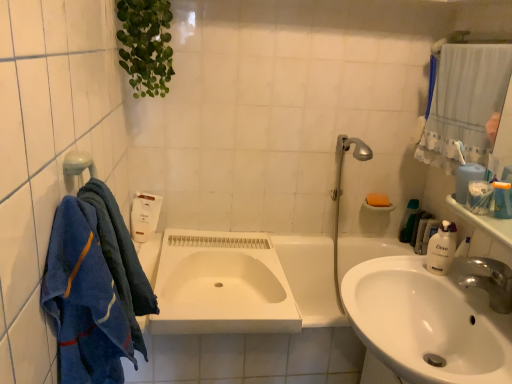
Question: Should I look upward or downward to see blue cotton towel at left, marked as the second bath towel in a back-to-front arrangement?

Choices:
 (A) down
 (B) up

Answer: (A)

Question: Is the position of white glossy sink at lower right, the first sink viewed from the right, more distant than that of white matte sink at center, the second sink from the front?

Choices:
 (A) yes
 (B) no

Answer: (B)

Question: From a real-world perspective, is white glossy sink at lower right, the 2th sink when ordered from left to right, on white matte sink at center, acting as the second sink starting from the right?

Choices:
 (A) yes
 (B) no

Answer: (A)

Question: Considering the relative sizes of white glossy sink at lower right, the first sink viewed from the right, and white matte sink at center, the second sink from the front, in the image provided, is white glossy sink at lower right, the first sink viewed from the right, thinner than white matte sink at center, the second sink from the front,?

Choices:
 (A) no
 (B) yes

Answer: (B)

Question: Is white glossy sink at lower right, the first sink when ordered from front to back, next to white matte sink at center, acting as the second sink starting from the right, and touching it?

Choices:
 (A) no
 (B) yes

Answer: (A)

Question: Is white glossy sink at lower right, the first sink when ordered from front to back, far from white matte sink at center, which is counted as the 1th sink, starting from the back?

Choices:
 (A) yes
 (B) no

Answer: (B)

Question: Is white glossy sink at lower right, the first sink when ordered from front to back, smaller than white matte sink at center, acting as the second sink starting from the right?

Choices:
 (A) no
 (B) yes

Answer: (A)

Question: Is white matte sink at center, which is counted as the 1th sink, starting from the back, oriented away from silver metallic showerhead at upper right?

Choices:
 (A) yes
 (B) no

Answer: (B)

Question: Is white matte sink at center, the first sink when ordered from left to right, aimed at silver metallic showerhead at upper right?

Choices:
 (A) no
 (B) yes

Answer: (A)

Question: From the image's perspective, is white matte sink at center, the second sink from the front, above silver metallic showerhead at upper right?

Choices:
 (A) no
 (B) yes

Answer: (A)

Question: Does white matte sink at center, the first sink when ordered from left to right, have a lesser height compared to silver metallic showerhead at upper right?

Choices:
 (A) yes
 (B) no

Answer: (A)

Question: Does white matte sink at center, acting as the second sink starting from the right, have a greater width compared to silver metallic showerhead at upper right?

Choices:
 (A) yes
 (B) no

Answer: (A)

Question: Can you confirm if white matte sink at center, the first sink when ordered from left to right, is positioned to the left of silver metallic showerhead at upper right?

Choices:
 (A) no
 (B) yes

Answer: (B)

Question: Is blue terry cloth towel at left, marked as the 1th bath towel in a back-to-front arrangement, surrounding blue cotton towel at left, acting as the 1th bath towel starting from the front?

Choices:
 (A) yes
 (B) no

Answer: (B)